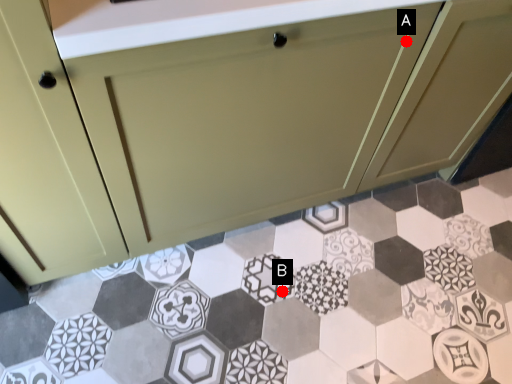
Question: Two points are circled on the image, labeled by A and B beside each circle. Which point appears farthest from the camera in this image?

Choices:
 (A) A is further
 (B) B is further

Answer: (B)